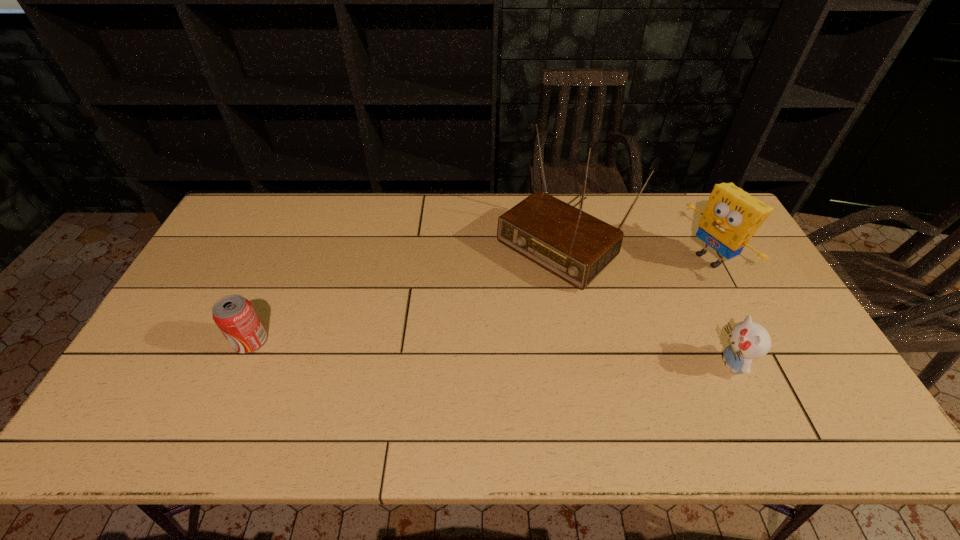
Where is `soda can`? This screenshot has width=960, height=540. soda can is located at coordinates (234, 315).

This screenshot has width=960, height=540. Identify the location of kitten. (748, 340).

Image resolution: width=960 pixels, height=540 pixels. Identify the location of the tallest object. (570, 243).

The width and height of the screenshot is (960, 540). I want to click on radio_receiver, so click(570, 243).

Find the location of `the second tallest object`. the second tallest object is located at coordinates (732, 216).

At what (x,y) coordinates should I click in order to perform the action: click on free space located 0.100m on the left of the leftmost object. Please return your answer as a coordinate pair (x, y). The height and width of the screenshot is (540, 960). Looking at the image, I should click on (196, 341).

Locate an element on the screen. The width and height of the screenshot is (960, 540). free region located 0.180m on the front-facing side of the kitten is located at coordinates (644, 363).

You are a GUI agent. You are given a task and a screenshot of the screen. Output one action in this format:
    pyautogui.click(x=<x>, y=<y>)
    Task: Click on the free space located 0.260m on the front-facing side of the kitten
    The width and height of the screenshot is (960, 540).
    Given the screenshot: What is the action you would take?
    pyautogui.click(x=613, y=363)

I want to click on free region located on the front-facing side of the kitten, so [x=606, y=363].

The width and height of the screenshot is (960, 540). I want to click on vacant region located on the front panel of the tallest object, so click(x=477, y=314).